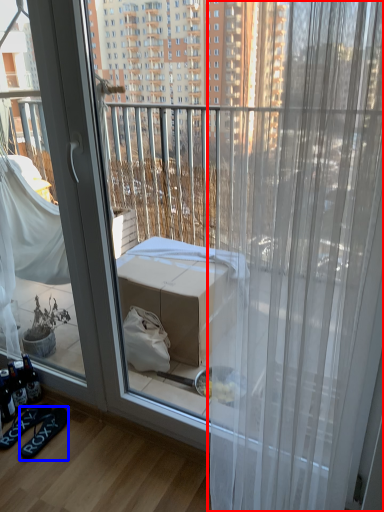
Question: Which of the following is the farthest to the observer, curtain (highlighted by a red box) or footwear (highlighted by a blue box)?

Choices:
 (A) curtain
 (B) footwear

Answer: (B)